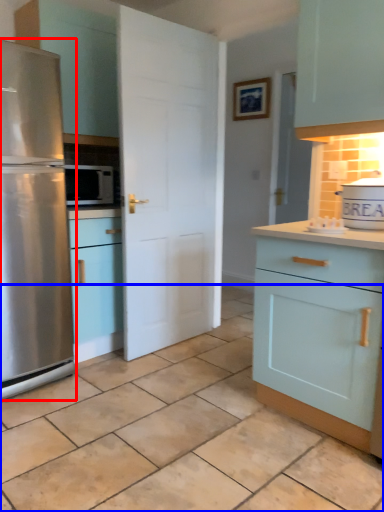
Question: Among these objects, which one is nearest to the camera, refrigerator (highlighted by a red box) or tile (highlighted by a blue box)?

Choices:
 (A) refrigerator
 (B) tile

Answer: (B)